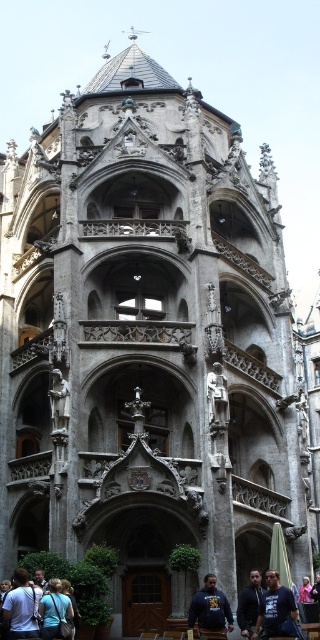
Question: Considering the relative positions of denim jacket at lower left and dark blue sweatshirt at lower center in the image provided, where is denim jacket at lower left located with respect to dark blue sweatshirt at lower center?

Choices:
 (A) below
 (B) above

Answer: (B)

Question: Which object is positioned closest to the dark blue hoodie at center?

Choices:
 (A) pink fabric jacket at lower center
 (B) light blue shirt at lower center

Answer: (A)

Question: Considering the real-world distances, which object is closest to the dark blue hoodie at center?

Choices:
 (A) pink fabric jacket at lower center
 (B) dark blue sweatshirt at lower center
 (C) dark blue hoodie at lower right

Answer: (B)

Question: Can you confirm if light blue shirt at lower center is wider than pink fabric jacket at lower center?

Choices:
 (A) no
 (B) yes

Answer: (B)

Question: In this image, where is dark blue sweatshirt at lower center located relative to light blue shirt at lower center?

Choices:
 (A) left
 (B) right

Answer: (B)

Question: Which object is the farthest from the dark blue hoodie at lower right?

Choices:
 (A) denim jacket at lower left
 (B) dark blue hoodie at center
 (C) dark blue sweatshirt at lower center

Answer: (A)